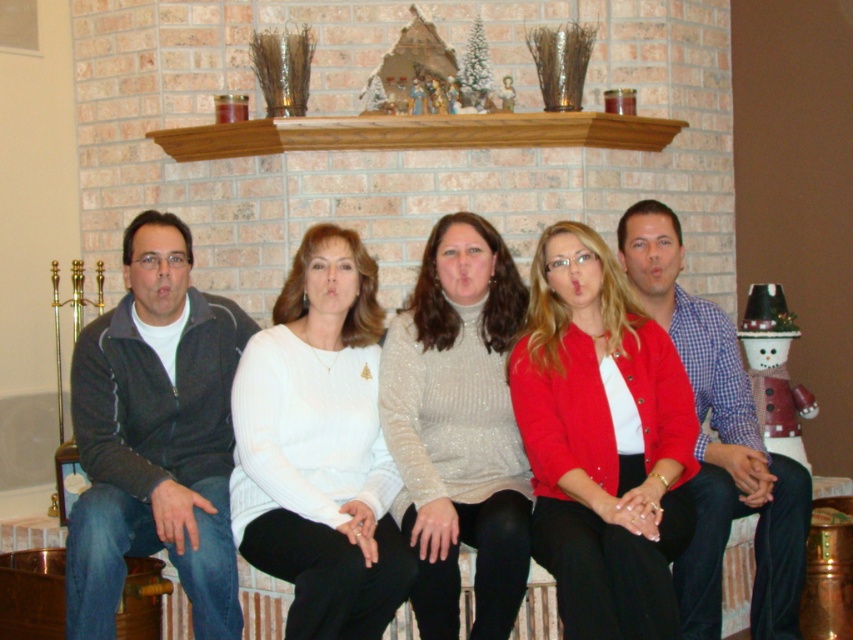
You are a tailor measuring the distance between two sweaters on the mantel for a display. The sweaters are the white sweater at center and the sparkly white turtleneck sweater at center. Can you fit a 12 inch wide decorative pillow between them?

The distance between the white sweater at center and the sparkly white turtleneck sweater at center is 13.66 inches. Since the pillow is 12 inches wide, there is enough space to fit it between them.